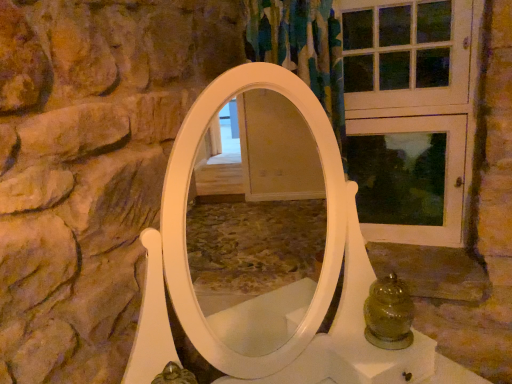
What do you see at coordinates (411, 115) in the screenshot? The height and width of the screenshot is (384, 512). I see `white wood screen door at upper right` at bounding box center [411, 115].

Image resolution: width=512 pixels, height=384 pixels. I want to click on white wood screen door at upper right, so click(x=411, y=115).

Describe the element at coordinates (389, 314) in the screenshot. I see `green glass jar at lower right` at that location.

The image size is (512, 384). In order to click on green glass jar at lower right in this screenshot , I will do `click(389, 314)`.

Find the location of a particular element. white wood screen door at upper right is located at coordinates (411, 115).

In the image, is white wood screen door at upper right on the left side or the right side of green glass jar at lower right?

From the image, it's evident that white wood screen door at upper right is to the right of green glass jar at lower right.

Considering their positions, is white wood screen door at upper right located in front of or behind green glass jar at lower right?

Visually, white wood screen door at upper right is located behind green glass jar at lower right.

Does point (411, 5) appear closer or farther from the camera than point (375, 315)?

Point (411, 5).

From the image's perspective, between white wood screen door at upper right and green glass jar at lower right, who is located below?

green glass jar at lower right appears lower in the image.

From a real-world perspective, who is located lower, white wood screen door at upper right or green glass jar at lower right?

green glass jar at lower right.

Does white wood screen door at upper right have a greater width compared to green glass jar at lower right?

No.

Does white wood screen door at upper right have a greater height compared to green glass jar at lower right?

Indeed, white wood screen door at upper right has a greater height compared to green glass jar at lower right.

In terms of size, does white wood screen door at upper right appear bigger or smaller than green glass jar at lower right?

In the image, white wood screen door at upper right appears to be larger than green glass jar at lower right.

Do you think white wood screen door at upper right is within green glass jar at lower right, or outside of it?

The correct answer is: outside.

Would you say white wood screen door at upper right is a long distance from green glass jar at lower right?

No, white wood screen door at upper right is not far from green glass jar at lower right.

Is green glass jar at lower right at the back of white wood screen door at upper right?

No.

The width and height of the screenshot is (512, 384). In the image, there is a white wood screen door at upper right. What are the coordinates of `glass jar below it (from a real-world perspective)` in the screenshot? It's located at (389, 314).

Is green glass jar at lower right to the right of white wood screen door at upper right from the viewer's perspective?

Incorrect, green glass jar at lower right is not on the right side of white wood screen door at upper right.

Looking at this image, is green glass jar at lower right behind white wood screen door at upper right?

No, the depth of green glass jar at lower right is less than that of white wood screen door at upper right.

Does point (399, 317) appear closer or farther from the camera than point (392, 177)?

Point (399, 317) is closer to the camera than point (392, 177).

From the image's perspective, does green glass jar at lower right appear lower than white wood screen door at upper right?

Correct, green glass jar at lower right appears lower than white wood screen door at upper right in the image.

From a real-world perspective, which is physically below, green glass jar at lower right or white wood screen door at upper right?

From a 3D spatial view, green glass jar at lower right is below.

In the scene shown: Does green glass jar at lower right have a lesser width compared to white wood screen door at upper right?

No, green glass jar at lower right is not thinner than white wood screen door at upper right.

In the scene shown: In terms of height, does green glass jar at lower right look taller or shorter compared to white wood screen door at upper right?

green glass jar at lower right is shorter than white wood screen door at upper right.

Considering the sizes of objects green glass jar at lower right and white wood screen door at upper right in the image provided, who is bigger, green glass jar at lower right or white wood screen door at upper right?

Bigger between the two is white wood screen door at upper right.

Is white wood screen door at upper right surrounded by green glass jar at lower right?

That's incorrect, white wood screen door at upper right is not inside green glass jar at lower right.

Looking at this image, is there a large distance between green glass jar at lower right and white wood screen door at upper right?

green glass jar at lower right is actually quite close to white wood screen door at upper right.

Is green glass jar at lower right looking in the opposite direction of white wood screen door at upper right?

No.

What's the angular difference between green glass jar at lower right and white wood screen door at upper right's facing directions?

The angular difference between green glass jar at lower right and white wood screen door at upper right is 49.7 degrees.

This screenshot has width=512, height=384. I want to click on glass jar that is in front of the white wood screen door at upper right, so click(x=389, y=314).

This screenshot has width=512, height=384. Find the location of `screen door behind the green glass jar at lower right`. screen door behind the green glass jar at lower right is located at coordinates point(411,115).

You are a GUI agent. You are given a task and a screenshot of the screen. Output one action in this format:
    pyautogui.click(x=<x>, y=<y>)
    Task: Click on the glass jar in front of the white wood screen door at upper right
    This screenshot has height=384, width=512.
    Given the screenshot: What is the action you would take?
    pyautogui.click(x=389, y=314)